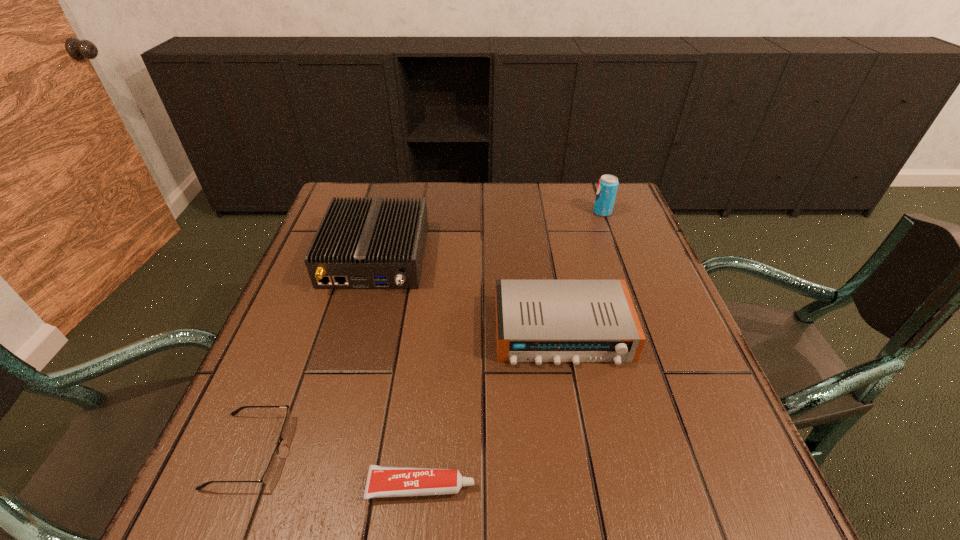
You are a GUI agent. You are given a task and a screenshot of the screen. Output one action in this format:
    pyautogui.click(x=<x>, y=<y>)
    Task: Click on the free space between the spectacles and the rightmost object
    
    Given the screenshot: What is the action you would take?
    pyautogui.click(x=426, y=332)

The width and height of the screenshot is (960, 540). I want to click on vacant space that is in between the router and the farthest object, so [489, 234].

I want to click on blank region between the third farthest object and the spectacles, so point(406,392).

The height and width of the screenshot is (540, 960). I want to click on free space between the spectacles and the farthest object, so click(426, 332).

Locate an element on the screen. The image size is (960, 540). free space that is in between the farthest object and the router is located at coordinates (489, 234).

Locate an element on the screen. Image resolution: width=960 pixels, height=540 pixels. free spot between the spectacles and the soda can is located at coordinates (426, 332).

Where is `free space between the router and the toothpaste`? The image size is (960, 540). free space between the router and the toothpaste is located at coordinates (398, 371).

This screenshot has height=540, width=960. I want to click on free spot between the spectacles and the farthest object, so pyautogui.click(x=426, y=332).

Find the location of a particular element. object that is the closest one to the toothpaste is located at coordinates (273, 464).

I want to click on the closest object relative to the toothpaste, so click(x=273, y=464).